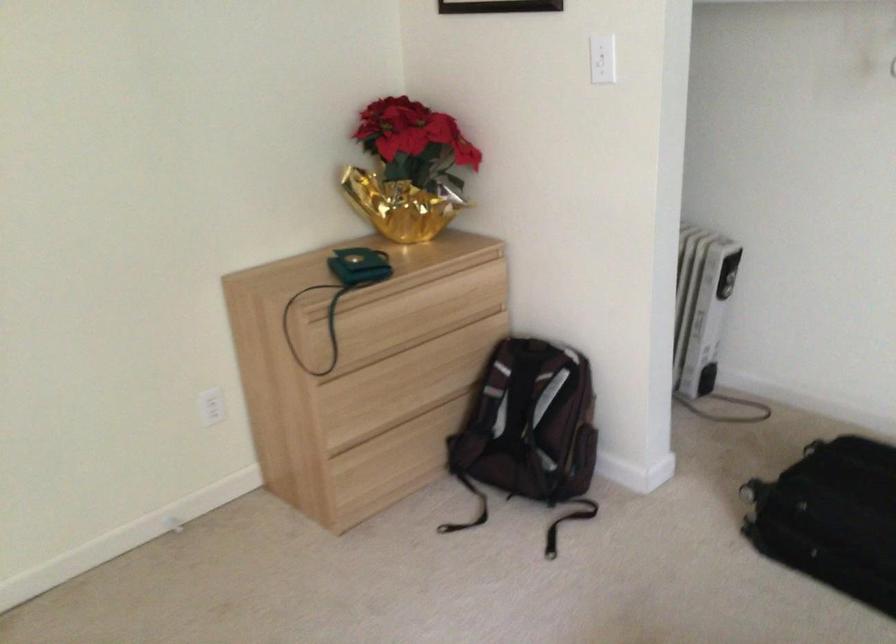
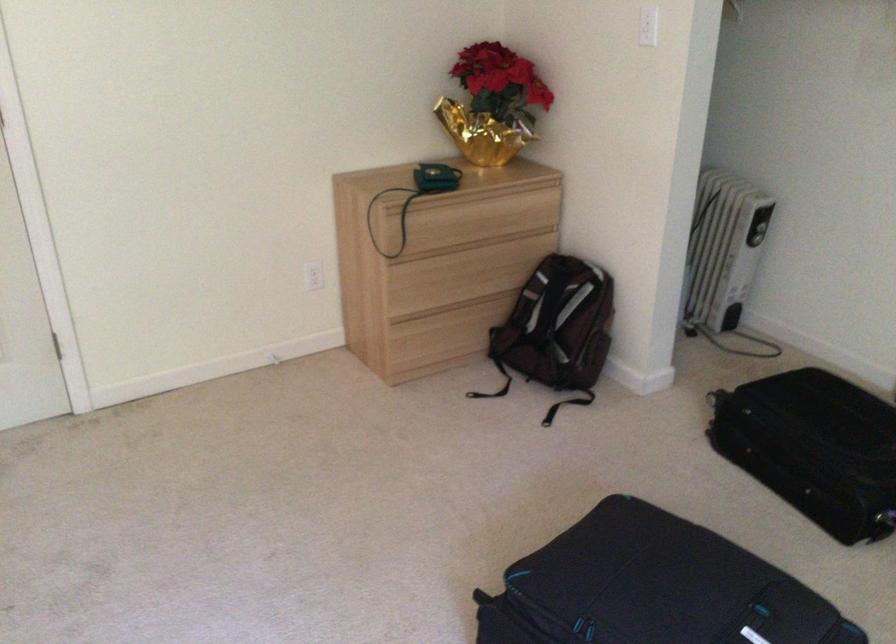
Find the pixel in the second image that matches point (412, 169) in the first image.

(493, 104)